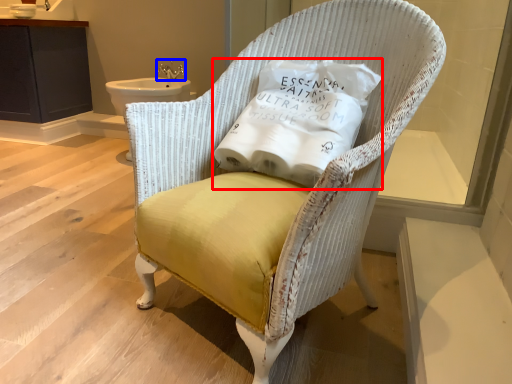
Question: Among these objects, which one is nearest to the camera, pillow (highlighted by a red box) or faucet (highlighted by a blue box)?

Choices:
 (A) pillow
 (B) faucet

Answer: (A)